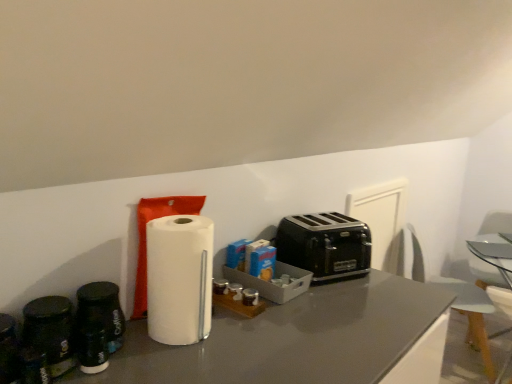
Image resolution: width=512 pixels, height=384 pixels. What do you see at coordinates (325, 245) in the screenshot? I see `black metallic toaster at center` at bounding box center [325, 245].

This screenshot has height=384, width=512. What do you see at coordinates (496, 223) in the screenshot?
I see `white plastic swivel chair at right, acting as the 2th swivel chair starting from the left` at bounding box center [496, 223].

What do you see at coordinates (98, 325) in the screenshot? I see `black matte coffee canister at left` at bounding box center [98, 325].

How much space does white plastic swivel chair at right, which is counted as the 1th swivel chair, starting from the left, occupy vertically?

The height of white plastic swivel chair at right, which is counted as the 1th swivel chair, starting from the left, is 32.47 inches.

The width and height of the screenshot is (512, 384). What do you see at coordinates (457, 300) in the screenshot?
I see `white plastic swivel chair at right, the 2th swivel chair positioned from the right` at bounding box center [457, 300].

The height and width of the screenshot is (384, 512). Find the location of `black metallic toaster at center`. black metallic toaster at center is located at coordinates (325, 245).

How much distance is there between white matte paper towel at center and clear glass table at center?

white matte paper towel at center and clear glass table at center are 1.99 meters apart from each other.

Can you confirm if white matte paper towel at center is positioned to the left of clear glass table at center?

Correct, you'll find white matte paper towel at center to the left of clear glass table at center.

Between white matte paper towel at center and clear glass table at center, which one has more height?

white matte paper towel at center is taller.

Looking at this image, from the image's perspective, relative to clear glass table at center, is white matte paper towel at center above or below?

Clearly, from the image's perspective, white matte paper towel at center is above clear glass table at center.

From the image's perspective, would you say white plastic swivel chair at right, which appears as the first swivel chair when viewed from the right, is shown under white matte paper towel at center?

Indeed, from the image's perspective, white plastic swivel chair at right, which appears as the first swivel chair when viewed from the right, is shown beneath white matte paper towel at center.

Considering the sizes of white plastic swivel chair at right, acting as the 2th swivel chair starting from the left, and white matte paper towel at center in the image, is white plastic swivel chair at right, acting as the 2th swivel chair starting from the left, wider or thinner than white matte paper towel at center?

white plastic swivel chair at right, acting as the 2th swivel chair starting from the left, is wider than white matte paper towel at center.

Is the depth of white plastic swivel chair at right, which appears as the first swivel chair when viewed from the right, greater than that of white matte paper towel at center?

Yes, white plastic swivel chair at right, which appears as the first swivel chair when viewed from the right, is further from the viewer.

Is white plastic swivel chair at right, acting as the 2th swivel chair starting from the left, in contact with white matte paper towel at center?

No, white plastic swivel chair at right, acting as the 2th swivel chair starting from the left, is not in contact with white matte paper towel at center.

Considering the sizes of objects white plastic swivel chair at right, acting as the 2th swivel chair starting from the left, and black matte coffee canister at left in the image provided, who is wider, white plastic swivel chair at right, acting as the 2th swivel chair starting from the left, or black matte coffee canister at left?

Wider between the two is white plastic swivel chair at right, acting as the 2th swivel chair starting from the left.

Is white plastic swivel chair at right, which appears as the first swivel chair when viewed from the right, far from black matte coffee canister at left?

white plastic swivel chair at right, which appears as the first swivel chair when viewed from the right, is positioned a significant distance from black matte coffee canister at left.

Can you tell me how much white plastic swivel chair at right, acting as the 2th swivel chair starting from the left, and black matte coffee canister at left differ in facing direction?

They differ by 70.2 degrees in their facing directions.

In terms of height, does white plastic swivel chair at right, which appears as the first swivel chair when viewed from the right, look taller or shorter compared to black matte coffee canister at left?

In the image, white plastic swivel chair at right, which appears as the first swivel chair when viewed from the right, appears to be taller than black matte coffee canister at left.

Based on the photo, from the image's perspective, is black matte coffee canister at left beneath white matte paper towel at center?

Yes, from the image's perspective, black matte coffee canister at left is beneath white matte paper towel at center.

Locate an element on the screen. This screenshot has width=512, height=384. paper towel located on the right of black matte coffee canister at left is located at coordinates (179, 279).

Is black matte coffee canister at left not near white matte paper towel at center?

No.

Is black matte coffee canister at left facing towards white matte paper towel at center?

No.

In terms of width, does clear glass table at center look wider or thinner when compared to black metallic toaster at center?

In the image, clear glass table at center appears to be wider than black metallic toaster at center.

From a real-world perspective, is clear glass table at center physically above black metallic toaster at center?

No, from a real-world perspective, clear glass table at center is not over black metallic toaster at center

Does point (500, 245) appear closer or farther from the camera than point (344, 276)?

Point (500, 245) is farther from the camera than point (344, 276).

Would you consider clear glass table at center to be distant from white plastic swivel chair at right, the 2th swivel chair positioned from the right?

Actually, clear glass table at center and white plastic swivel chair at right, the 2th swivel chair positioned from the right, are a little close together.

Is clear glass table at center positioned with its back to white plastic swivel chair at right, the 2th swivel chair positioned from the right?

That's right, clear glass table at center is facing away from white plastic swivel chair at right, the 2th swivel chair positioned from the right.

Which object is further away from the camera, clear glass table at center or white plastic swivel chair at right, which is counted as the 1th swivel chair, starting from the left?

Positioned behind is clear glass table at center.

Looking at this image, from a real-world perspective, is clear glass table at center beneath white plastic swivel chair at right, the 2th swivel chair positioned from the right?

Actually, clear glass table at center is physically above white plastic swivel chair at right, the 2th swivel chair positioned from the right, in the real world.

From the picture: From a real-world perspective, is black metallic toaster at center above or below clear glass table at center?

black metallic toaster at center is situated higher than clear glass table at center in the real world.

Considering the sizes of black metallic toaster at center and clear glass table at center in the image, is black metallic toaster at center wider or thinner than clear glass table at center?

Considering their sizes, black metallic toaster at center looks slimmer than clear glass table at center.

Can you tell me how much black metallic toaster at center and clear glass table at center differ in facing direction?

They differ by 126 degrees in their facing directions.

Would you consider black metallic toaster at center to be distant from clear glass table at center?

Yes, black metallic toaster at center and clear glass table at center are quite far apart.

I want to click on paper towel above the clear glass table at center (from a real-world perspective), so click(x=179, y=279).

The width and height of the screenshot is (512, 384). I want to click on the 2nd swivel chair counting from the right of the white matte paper towel at center, so click(496, 223).

Considering their positions, is white plastic swivel chair at right, the 2th swivel chair positioned from the right, positioned closer to white plastic swivel chair at right, which appears as the first swivel chair when viewed from the right, than white matte paper towel at center?

white plastic swivel chair at right, the 2th swivel chair positioned from the right.

Looking at the image, which one is located closer to clear glass table at center, white plastic swivel chair at right, the 2th swivel chair positioned from the right, or white plastic swivel chair at right, acting as the 2th swivel chair starting from the left?

white plastic swivel chair at right, the 2th swivel chair positioned from the right, is closer to clear glass table at center.

Estimate the real-world distances between objects in this image. Which object is further from white matte paper towel at center, black matte coffee canister at left or clear glass table at center?

clear glass table at center lies further to white matte paper towel at center than the other object.

When comparing their distances from black metallic toaster at center, does black matte coffee canister at left or white plastic swivel chair at right, acting as the 2th swivel chair starting from the left, seem closer?

black matte coffee canister at left lies closer to black metallic toaster at center than the other object.

From the image, which object appears to be farther from clear glass table at center, white plastic swivel chair at right, which appears as the first swivel chair when viewed from the right, or black metallic toaster at center?

Based on the image, black metallic toaster at center appears to be further to clear glass table at center.

Looking at the image, which one is located closer to white plastic swivel chair at right, acting as the 2th swivel chair starting from the left, black matte coffee canister at left or clear glass table at center?

Based on the image, clear glass table at center appears to be nearer to white plastic swivel chair at right, acting as the 2th swivel chair starting from the left.

From the image, which object appears to be farther from black metallic toaster at center, white plastic swivel chair at right, the 2th swivel chair positioned from the right, or white matte paper towel at center?

Among the two, white plastic swivel chair at right, the 2th swivel chair positioned from the right, is located further to black metallic toaster at center.

From the image, which object appears to be nearer to black matte coffee canister at left, white matte paper towel at center or white plastic swivel chair at right, which appears as the first swivel chair when viewed from the right?

white matte paper towel at center.

The width and height of the screenshot is (512, 384). I want to click on swivel chair situated between black matte coffee canister at left and clear glass table at center from left to right, so click(x=457, y=300).

Image resolution: width=512 pixels, height=384 pixels. Find the location of `table between black metallic toaster at center and white plastic swivel chair at right, which appears as the first swivel chair when viewed from the right, in the horizontal direction`. table between black metallic toaster at center and white plastic swivel chair at right, which appears as the first swivel chair when viewed from the right, in the horizontal direction is located at coordinates (490, 247).

I want to click on swivel chair between black metallic toaster at center and white plastic swivel chair at right, acting as the 2th swivel chair starting from the left, so click(x=457, y=300).

You are a GUI agent. You are given a task and a screenshot of the screen. Output one action in this format:
    pyautogui.click(x=<x>, y=<y>)
    Task: Click on the paper towel located between black matte coffee canister at left and white plastic swivel chair at right, acting as the 2th swivel chair starting from the left, in the left-right direction
    The width and height of the screenshot is (512, 384).
    Given the screenshot: What is the action you would take?
    pyautogui.click(x=179, y=279)